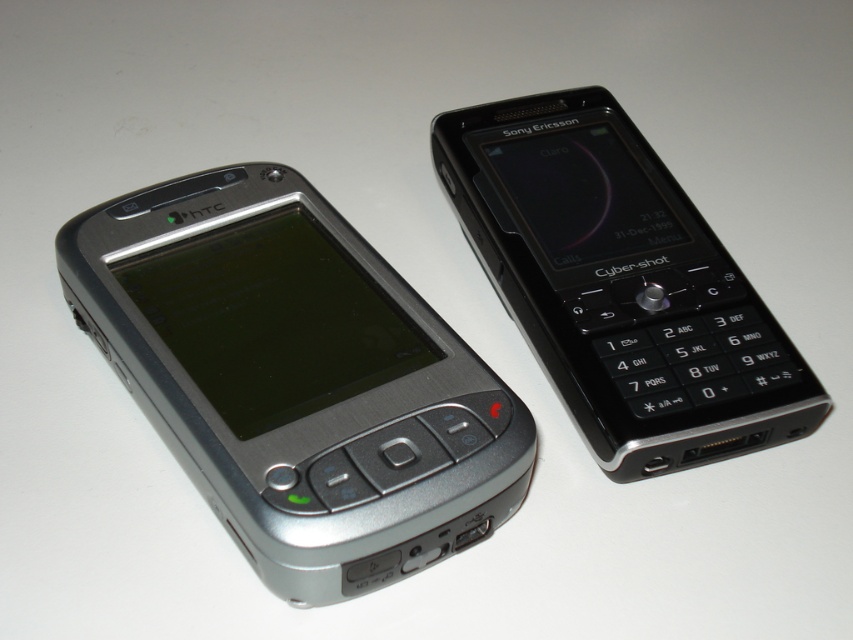
You are a technician trying to locate the silver metallic smartphone at left in an image. The coordinate system has its origin at the bottom left corner of the image. Can you confirm if the point at coordinate (296, 378) lies on the silver metallic smartphone at left?

The point at coordinate (296, 378) does lie on the silver metallic smartphone at left as indicated by the description.